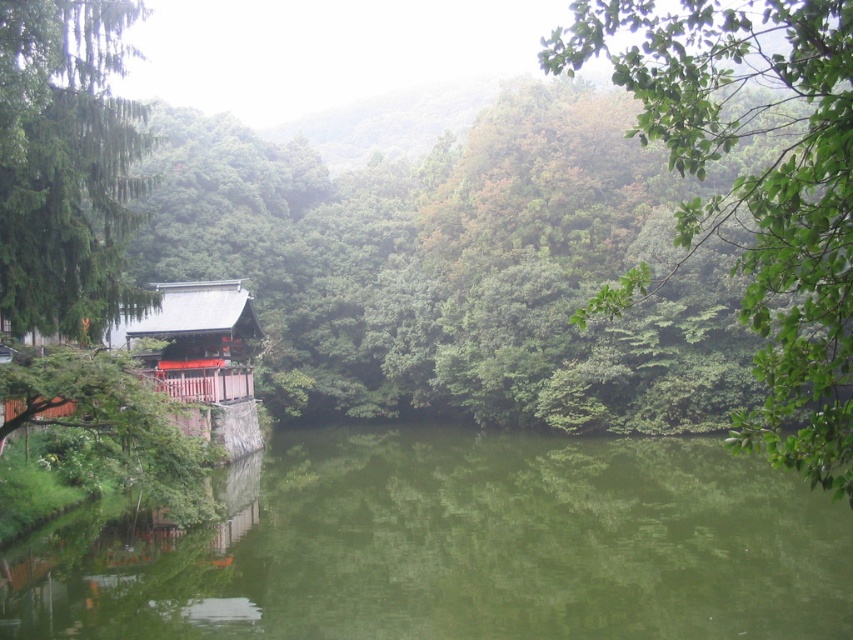
You are standing at the traditional Japanese pavilion on the left side of the image. Looking towards the center of the pond, you notice a point marked at coordinates (x=459, y=547). What is located at this point?

The point at coordinates (x=459, y=547) marks green reflective water at center.

You are planning to take a photo of the shiny red wood hut at left from the green leafy tree at left. Will the tree block your view of the hut?

The green leafy tree at left is bigger than the shiny red wood hut at left, so it might block the view of the hut when taking a photo from that position.

You are planning to take a photo of the shiny red wood hut at left from the green leafy tree at upper right. Will the tree block your view of the hut?

The green leafy tree at upper right is much taller than the shiny red wood hut at left, so it might block the view of the hut from that angle.